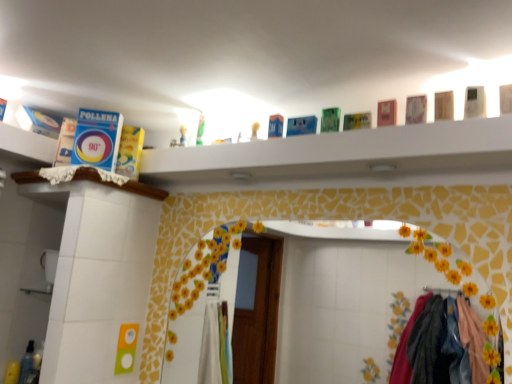
Question: Considering the relative sizes of translucent plastic bottle at lower left and wooden ledge at upper left, the 2th ledge viewed from the top, in the image provided, is translucent plastic bottle at lower left wider than wooden ledge at upper left, the 2th ledge viewed from the top,?

Choices:
 (A) no
 (B) yes

Answer: (A)

Question: From the image's perspective, is translucent plastic bottle at lower left on top of wooden ledge at upper left, marked as the 1th ledge in a bottom-to-top arrangement?

Choices:
 (A) no
 (B) yes

Answer: (A)

Question: Is translucent plastic bottle at lower left smaller than wooden ledge at upper left, marked as the 1th ledge in a bottom-to-top arrangement?

Choices:
 (A) no
 (B) yes

Answer: (B)

Question: Could you tell me if translucent plastic bottle at lower left is facing wooden ledge at upper left, marked as the 1th ledge in a bottom-to-top arrangement?

Choices:
 (A) no
 (B) yes

Answer: (A)

Question: Is translucent plastic bottle at lower left shorter than wooden ledge at upper left, marked as the 1th ledge in a bottom-to-top arrangement?

Choices:
 (A) yes
 (B) no

Answer: (B)

Question: Considering the relative sizes of translucent plastic bottle at lower left and wooden ledge at upper left, the 2th ledge viewed from the top, in the image provided, is translucent plastic bottle at lower left bigger than wooden ledge at upper left, the 2th ledge viewed from the top,?

Choices:
 (A) yes
 (B) no

Answer: (B)

Question: Considering the relative positions of blue cardboard box at upper center, arranged as the first ledge when viewed from the top, and wooden ledge at upper left, marked as the 1th ledge in a bottom-to-top arrangement, in the image provided, is blue cardboard box at upper center, arranged as the first ledge when viewed from the top, to the left of wooden ledge at upper left, marked as the 1th ledge in a bottom-to-top arrangement, from the viewer's perspective?

Choices:
 (A) yes
 (B) no

Answer: (B)

Question: Are blue cardboard box at upper center, arranged as the first ledge when viewed from the top, and wooden ledge at upper left, the 2th ledge viewed from the top, beside each other?

Choices:
 (A) yes
 (B) no

Answer: (B)

Question: Can you confirm if blue cardboard box at upper center, placed as the 2th ledge when sorted from bottom to top, is thinner than wooden ledge at upper left, the 2th ledge viewed from the top?

Choices:
 (A) no
 (B) yes

Answer: (B)

Question: Does blue cardboard box at upper center, arranged as the first ledge when viewed from the top, have a greater width compared to wooden ledge at upper left, marked as the 1th ledge in a bottom-to-top arrangement?

Choices:
 (A) yes
 (B) no

Answer: (B)

Question: From the image's perspective, is blue cardboard box at upper center, arranged as the first ledge when viewed from the top, over wooden ledge at upper left, the 2th ledge viewed from the top?

Choices:
 (A) yes
 (B) no

Answer: (A)

Question: Is the position of blue cardboard box at upper center, arranged as the first ledge when viewed from the top, more distant than that of wooden ledge at upper left, marked as the 1th ledge in a bottom-to-top arrangement?

Choices:
 (A) yes
 (B) no

Answer: (B)

Question: Is wooden ledge at upper left, marked as the 1th ledge in a bottom-to-top arrangement, aimed at blue cardboard box at upper center, arranged as the first ledge when viewed from the top?

Choices:
 (A) no
 (B) yes

Answer: (A)